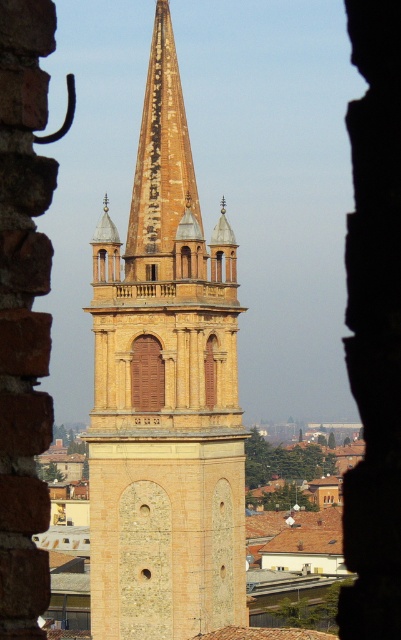
Question: Is brown wooden door at center in front of matte wood window at center?

Choices:
 (A) yes
 (B) no

Answer: (A)

Question: Estimate the real-world distances between objects in this image. Which object is closer to the yellow stone tower at center?

Choices:
 (A) brown wooden door at center
 (B) matte wood window at center

Answer: (A)

Question: Which of the following is the farthest from the observer?

Choices:
 (A) yellow stone tower at center
 (B) matte wood window at center

Answer: (B)

Question: Is brown wooden door at center closer to camera compared to matte wood window at center?

Choices:
 (A) no
 (B) yes

Answer: (B)

Question: Is yellow stone tower at center bigger than brown wooden door at center?

Choices:
 (A) yes
 (B) no

Answer: (A)

Question: Which object is positioned closest to the yellow stone tower at center?

Choices:
 (A) brown wooden door at center
 (B) matte wood window at center

Answer: (A)